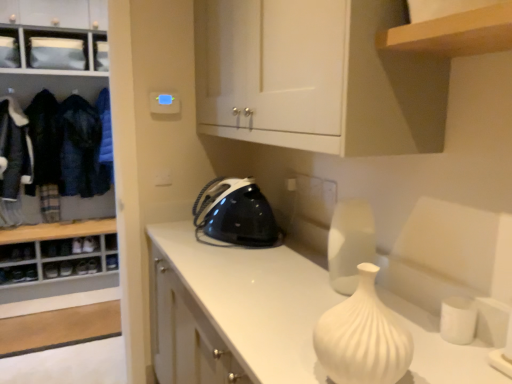
At what (x,y) coordinates should I click in order to perform the action: click on free space to the left of white matte vase at center. Please return your answer as a coordinate pair (x, y). This screenshot has width=512, height=384. Looking at the image, I should click on pyautogui.click(x=296, y=295).